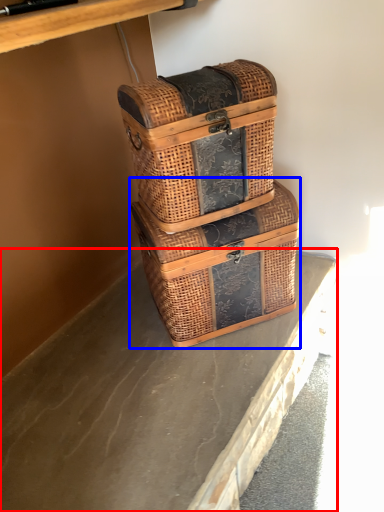
Question: Which point is closer to the camera, concrete (highlighted by a red box) or picnic basket (highlighted by a blue box)?

Choices:
 (A) concrete
 (B) picnic basket

Answer: (A)